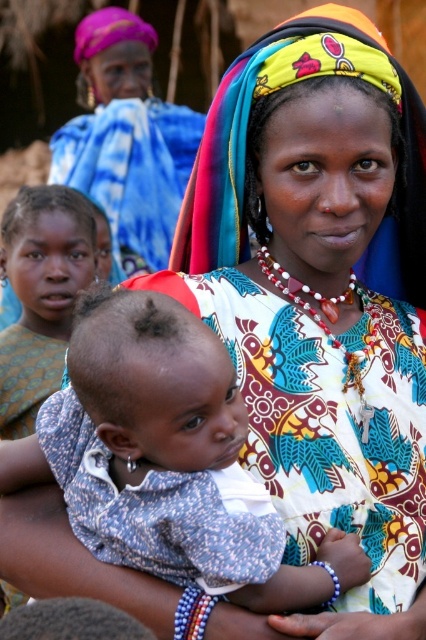
Question: Can you confirm if matte colorful headscarf at upper center is positioned to the right of matte brown skin at center?

Choices:
 (A) no
 (B) yes

Answer: (B)

Question: Is blue dotted fabric baby at center smaller than matte colorful headscarf at upper center?

Choices:
 (A) no
 (B) yes

Answer: (B)

Question: Which object appears closest to the camera in this image?

Choices:
 (A) matte brown skin at center
 (B) blue dotted fabric baby at center

Answer: (B)

Question: Which of the following is the closest to the observer?

Choices:
 (A) blue dotted fabric baby at center
 (B) matte brown skin at center

Answer: (A)

Question: Considering the relative positions of blue dotted fabric baby at center and matte colorful headscarf at upper center in the image provided, where is blue dotted fabric baby at center located with respect to matte colorful headscarf at upper center?

Choices:
 (A) right
 (B) left

Answer: (A)

Question: Which object is farther from the camera taking this photo?

Choices:
 (A) blue dotted fabric baby at center
 (B) matte brown skin at center

Answer: (B)